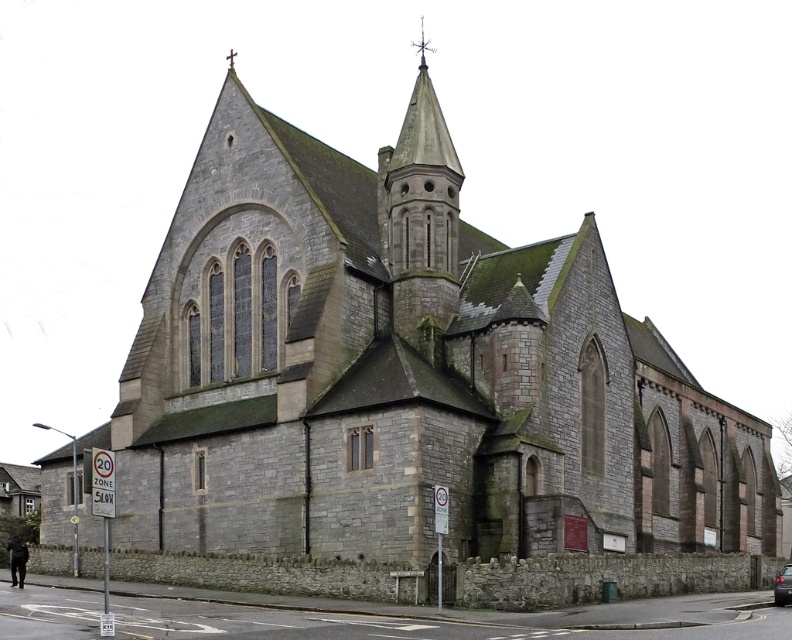
Question: Can you confirm if dark gray stone spire at center is bigger than metallic silver car at lower right?

Choices:
 (A) yes
 (B) no

Answer: (A)

Question: Among these points, which one is farthest from the camera?

Choices:
 (A) tap(786, 589)
 (B) tap(417, 333)

Answer: (B)

Question: Among these objects, which one is nearest to the camera?

Choices:
 (A) dark gray stone spire at center
 (B) metallic silver car at lower right

Answer: (B)

Question: Can you confirm if dark gray stone spire at center is thinner than metallic silver car at lower right?

Choices:
 (A) no
 (B) yes

Answer: (B)

Question: Is dark gray stone spire at center thinner than metallic silver car at lower right?

Choices:
 (A) yes
 (B) no

Answer: (A)